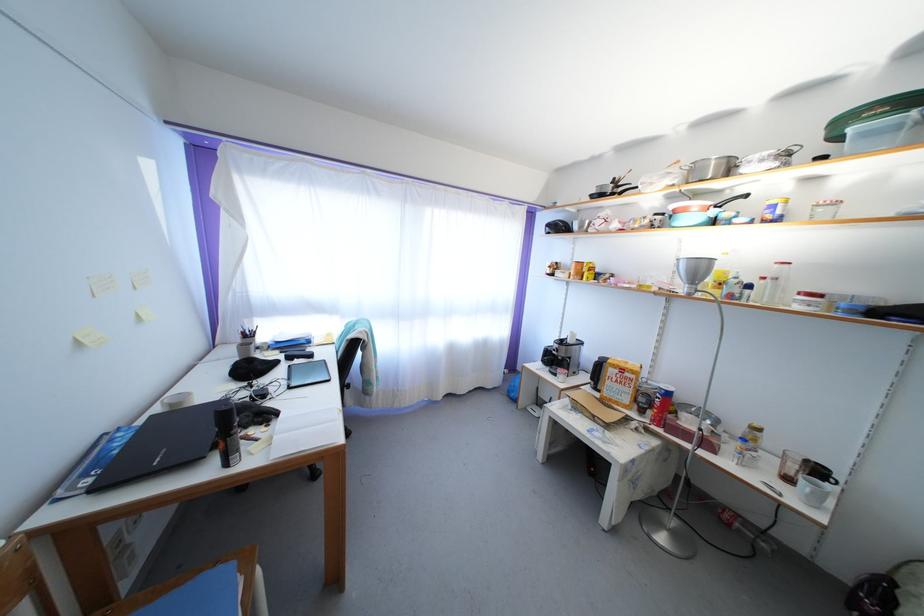
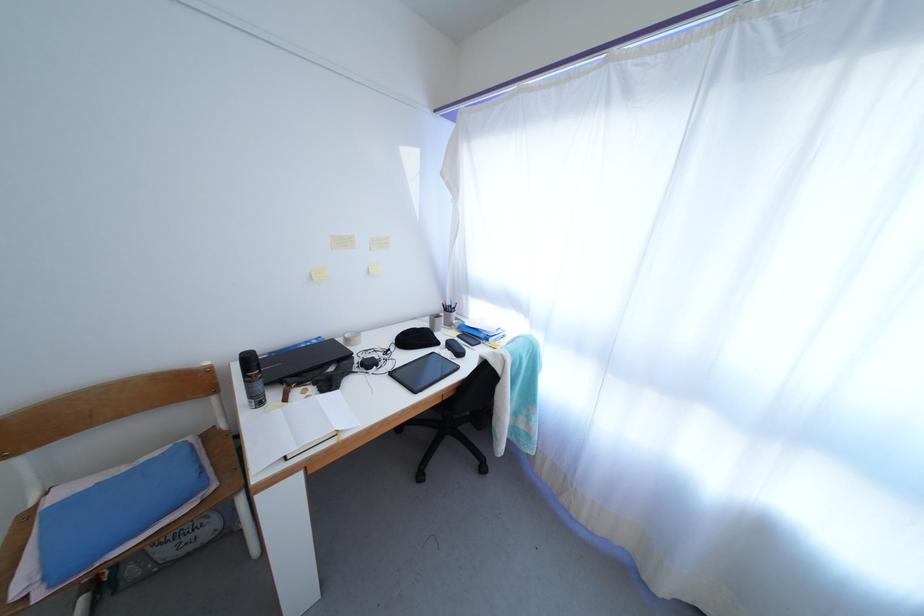
In the second image, find the point that corresponds to pixel 262 446 in the first image.

(290, 406)